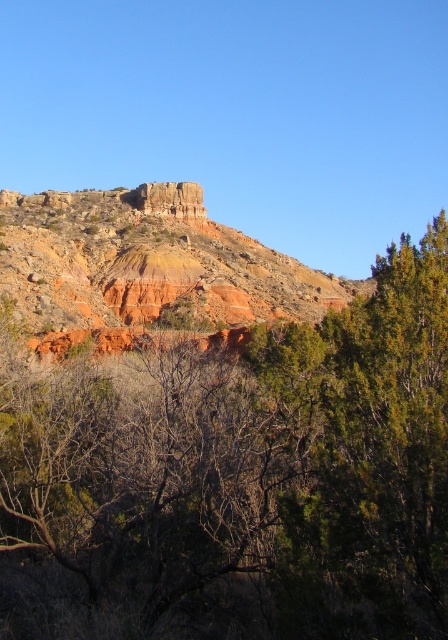
Is green leafy tree at upper center in front of rustic rock formation at center?

Yes, green leafy tree at upper center is closer to the viewer.

The image size is (448, 640). Describe the element at coordinates (241, 476) in the screenshot. I see `green leafy tree at upper center` at that location.

The height and width of the screenshot is (640, 448). What do you see at coordinates (241, 476) in the screenshot?
I see `green leafy tree at upper center` at bounding box center [241, 476].

Where is `green leafy tree at upper center`? Image resolution: width=448 pixels, height=640 pixels. green leafy tree at upper center is located at coordinates (241, 476).

Who is higher up, green leafy tree at upper right or rustic rock formation at center?

rustic rock formation at center is higher up.

Is green leafy tree at upper right shorter than rustic rock formation at center?

Yes, green leafy tree at upper right is shorter than rustic rock formation at center.

Is point (425, 337) positioned before point (172, 276)?

Yes, point (425, 337) is in front of point (172, 276).

Locate an element on the screen. This screenshot has width=448, height=640. green leafy tree at upper right is located at coordinates 369,454.

Is green leafy tree at upper center further to the viewer compared to green leafy tree at upper right?

No, green leafy tree at upper center is in front of green leafy tree at upper right.

Does green leafy tree at upper center have a larger size compared to green leafy tree at upper right?

Yes.

Identify the location of green leafy tree at upper center. (241, 476).

Locate an element on the screen. This screenshot has width=448, height=640. green leafy tree at upper center is located at coordinates (241, 476).